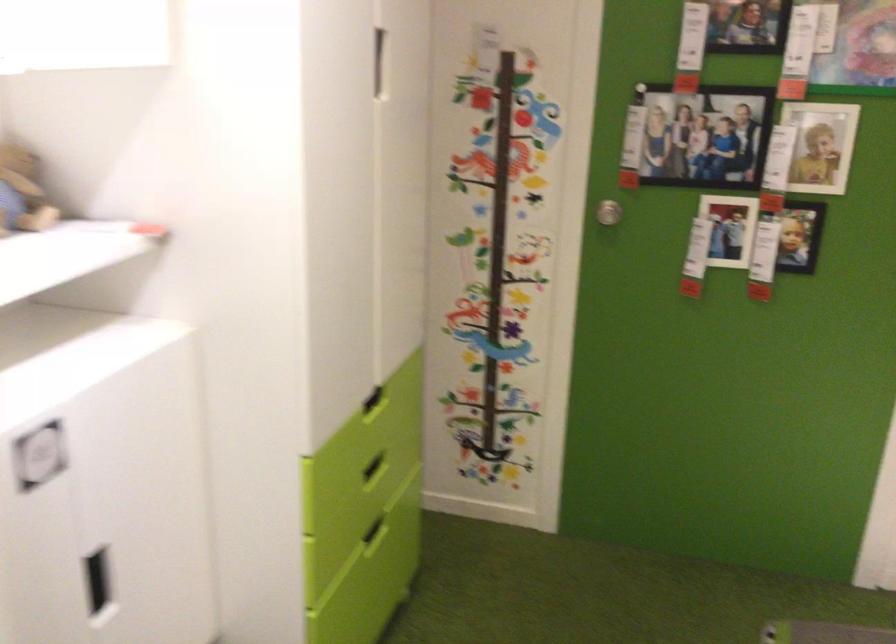
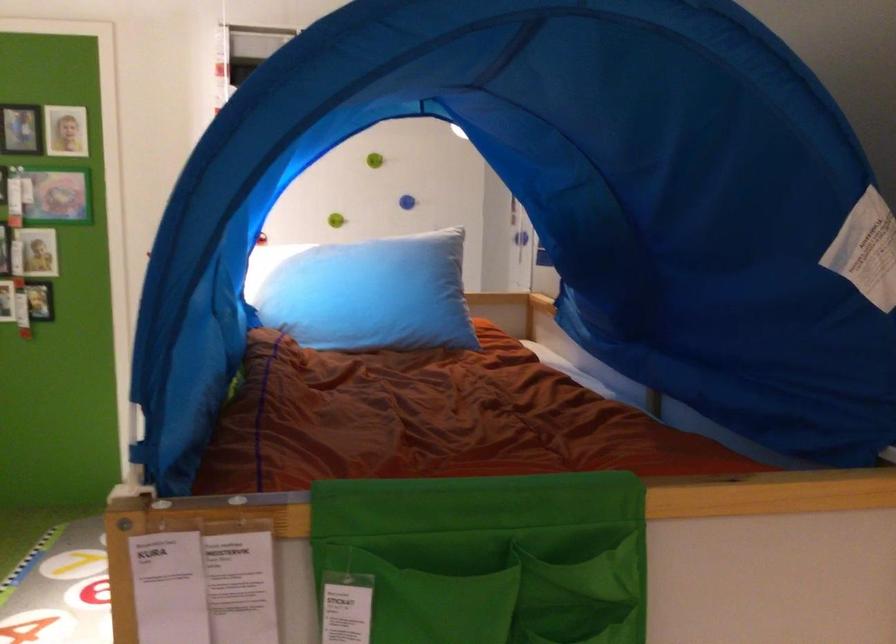
Locate, in the second image, the point that corresponds to (x=803, y=214) in the first image.

(39, 301)